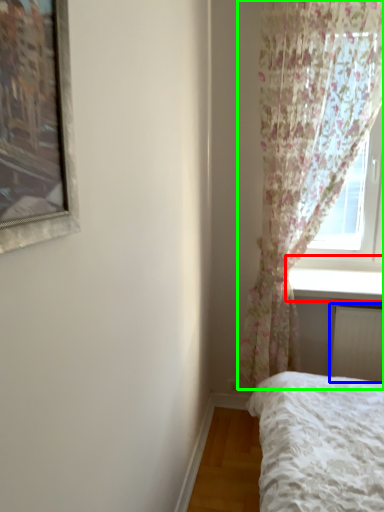
Question: Estimate the real-world distances between objects in this image. Which object is farther from window sill (highlighted by a red box), radiator (highlighted by a blue box) or curtain (highlighted by a green box)?

Choices:
 (A) radiator
 (B) curtain

Answer: (B)